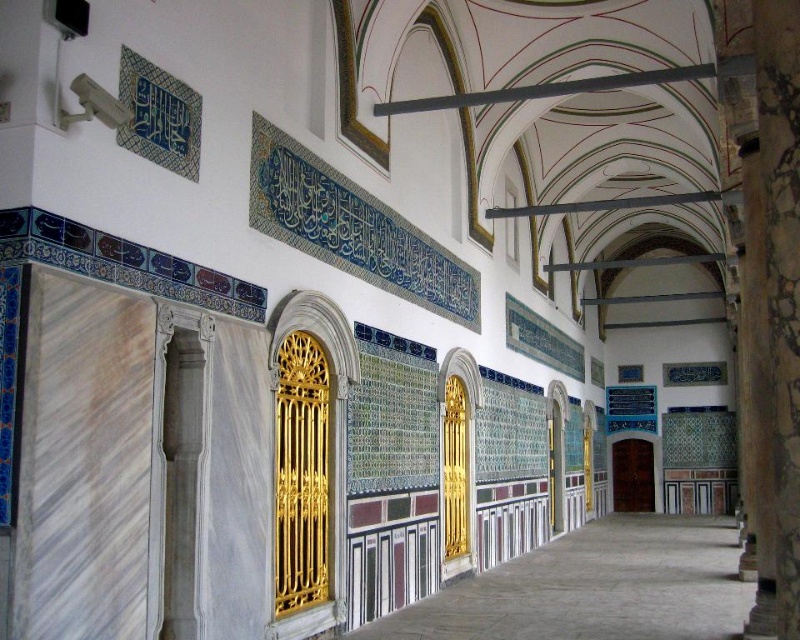
Is gold metallic door at center above brown wooden door at center?

Indeed, gold metallic door at center is positioned over brown wooden door at center.

Who is more forward, (x=306, y=476) or (x=628, y=467)?

Point (x=306, y=476) is more forward.

I want to click on gold metallic door at center, so click(x=302, y=474).